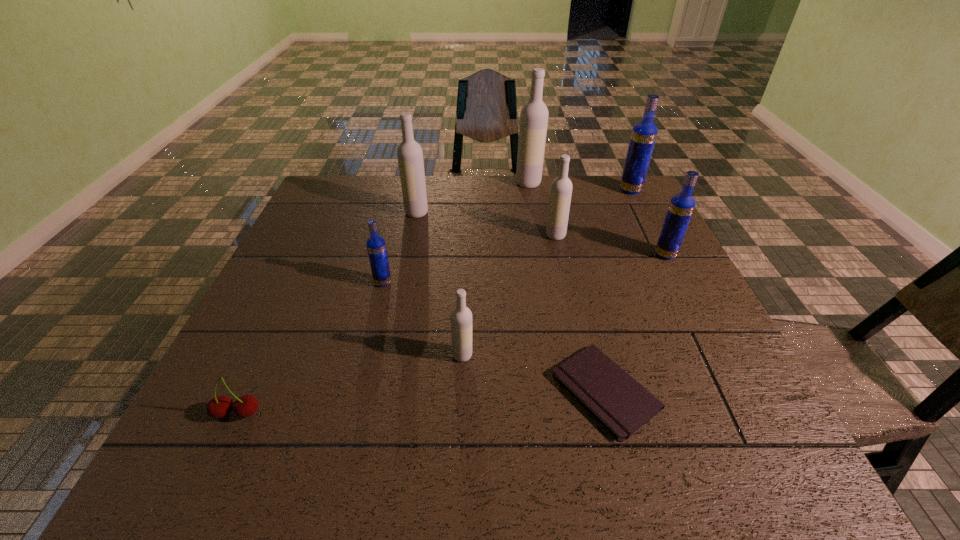
The width and height of the screenshot is (960, 540). Identify the location of the smallest blue vodka. (376, 247).

Find the location of a particular element. The width and height of the screenshot is (960, 540). the fourth object from left to right is located at coordinates (461, 316).

You are a GUI agent. You are given a task and a screenshot of the screen. Output one action in this format:
    pyautogui.click(x=<x>, y=<y>)
    Task: Click on the smallest white vodka
    This screenshot has width=960, height=540.
    Given the screenshot: What is the action you would take?
    pyautogui.click(x=461, y=316)

Where is `the eighth tallest object`? The height and width of the screenshot is (540, 960). the eighth tallest object is located at coordinates (245, 406).

Find the location of a particular element. the leftmost object is located at coordinates (245, 406).

Locate an element on the screen. Image resolution: width=960 pixels, height=540 pixels. checkbook is located at coordinates (622, 405).

The height and width of the screenshot is (540, 960). Identify the location of free space located on the left of the biggest white vodka. (465, 183).

You are a GUI agent. You are given a task and a screenshot of the screen. Output one action in this format:
    pyautogui.click(x=<x>, y=<y>)
    Task: Click on the vacant area situated on the left of the biggest blue vodka
    
    Given the screenshot: What is the action you would take?
    pyautogui.click(x=576, y=190)

You are a GUI agent. You are given a task and a screenshot of the screen. Output one action in this format:
    pyautogui.click(x=<x>, y=<y>)
    Task: Click on the free space located 0.150m on the front of the third smallest white vodka
    
    Given the screenshot: What is the action you would take?
    point(409,250)

Locate an element on the screen. The height and width of the screenshot is (540, 960). vacant space located 0.210m on the right of the third farthest white vodka is located at coordinates (640, 235).